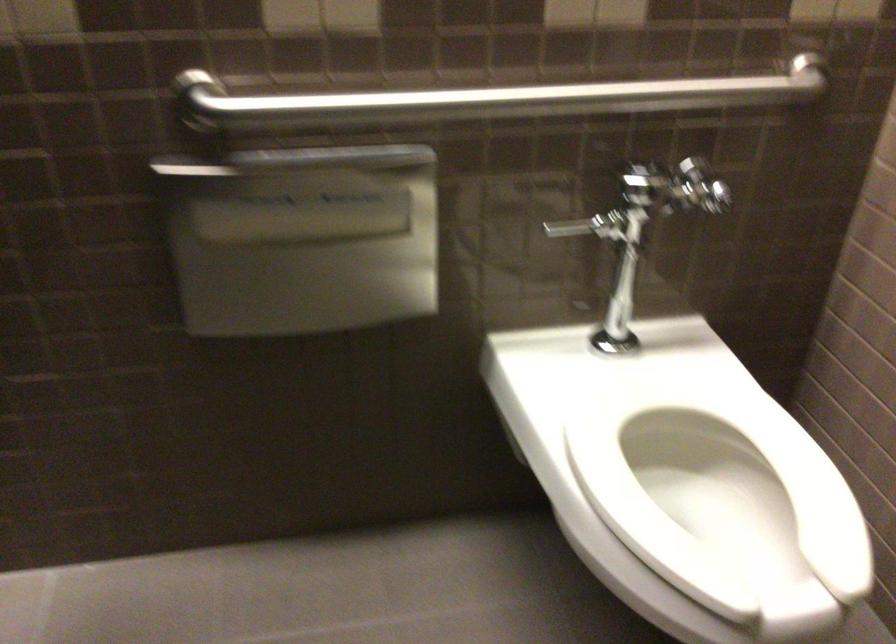
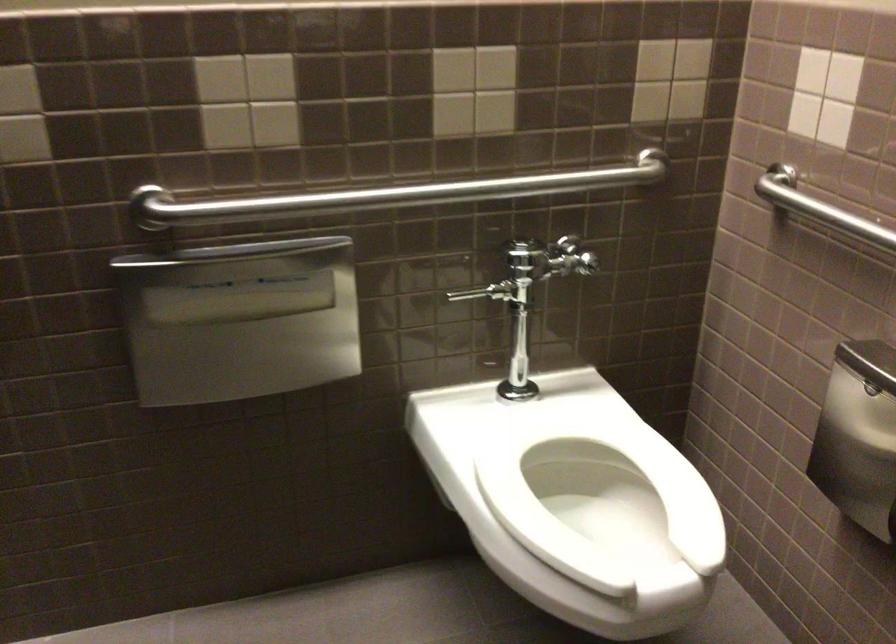
Question: The first image is from the beginning of the video and the second image is from the end. How did the camera likely rotate when shooting the video?

Choices:
 (A) Left
 (B) Right
 (C) Up
 (D) Down

Answer: (C)